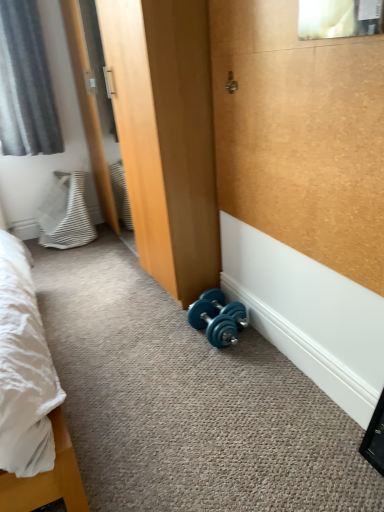
The width and height of the screenshot is (384, 512). I want to click on vacant space positioned to the left of teal rubber dumbbell at lower center, so click(160, 339).